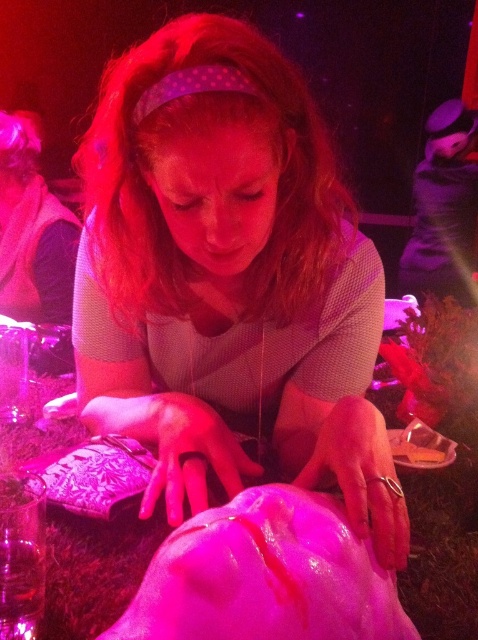
You are organizing a photoshoot and need to place a 15 cm wide accessory on the matte pink fabric at center and the pink fabric table at center. Based on their widths, which surface can accommodate the accessory without it hanging off the edge?

The pink fabric table at center has a greater width than the matte pink fabric at center, so the accessory can be placed on the pink fabric table at center without it hanging off the edge.

You are an interior designer assessing the placement of objects in this room. The matte pink fabric at center is part of a new decor piece you want to place on a shelf. Given its current position at coordinates point 0.434, 0.479, can you confirm if it is centrally positioned on the shelf?

The matte pink fabric at center is located at point (228, 276), which indicates it is centrally positioned on the shelf.

You are an interior designer assessing the layout of this space. You need to determine if the matte pink fabric at center can be moved behind the pink fabric table at center without obstructing the view of the table. Based on their current positions, is this possible?

The matte pink fabric at center is currently in front of the pink fabric table at center, so moving it behind would require space behind the table. Since the description only states their relative positions and not the table size or space behind, it is possible if there is enough space behind the table to accommodate the fabric without blocking the table view.